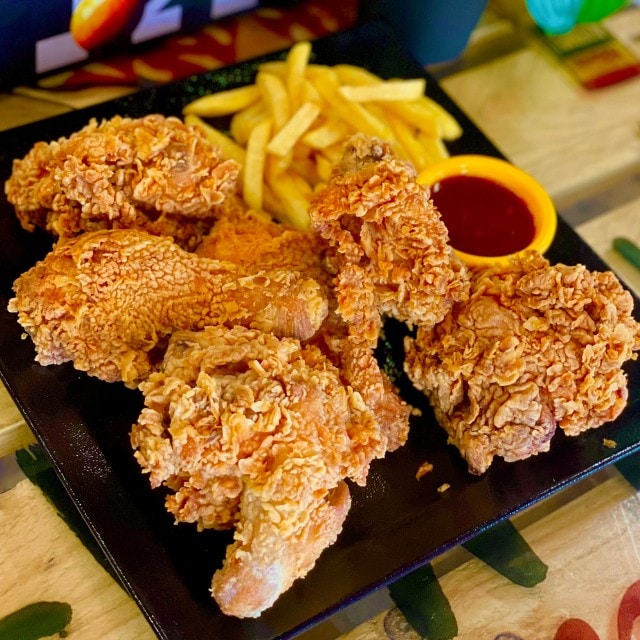
I want to click on yellow dish, so pyautogui.click(x=548, y=220).